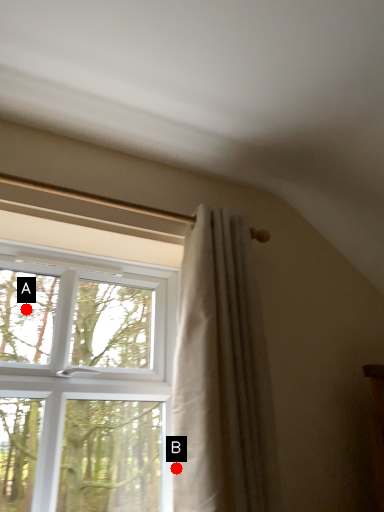
Question: Two points are circled on the image, labeled by A and B beside each circle. Which point is closer to the camera?

Choices:
 (A) A is closer
 (B) B is closer

Answer: (B)